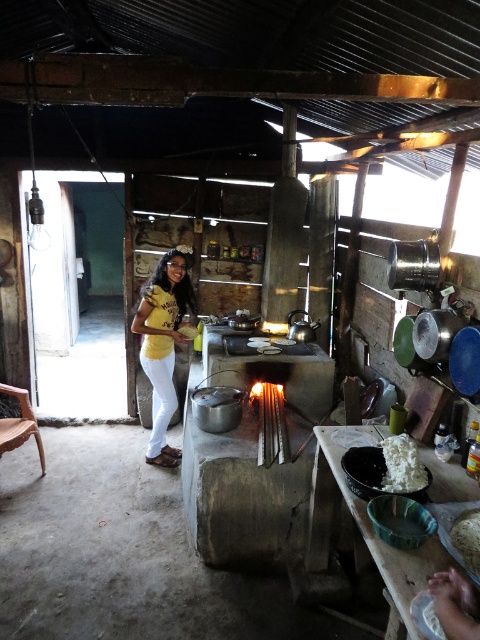
Question: Among these points, which one is nearest to the camera?

Choices:
 (A) (406, 435)
 (B) (162, 346)

Answer: (A)

Question: Is yellow matte shirt at center positioned before white fluffy rice at lower right?

Choices:
 (A) no
 (B) yes

Answer: (A)

Question: Is yellow matte shirt at center bigger than white fluffy rice at lower right?

Choices:
 (A) yes
 (B) no

Answer: (A)

Question: Which point is closer to the camera?

Choices:
 (A) white fluffy rice at lower right
 (B) yellow matte shirt at center

Answer: (A)

Question: Can you confirm if yellow matte shirt at center is positioned above white fluffy rice at lower right?

Choices:
 (A) no
 (B) yes

Answer: (B)